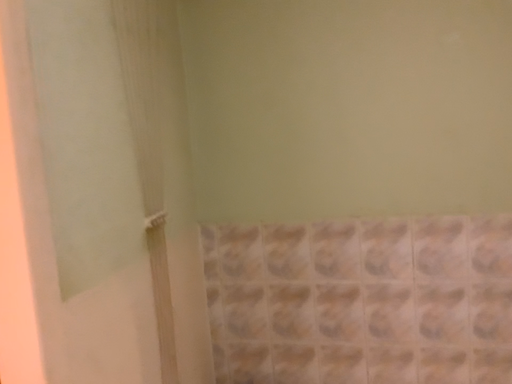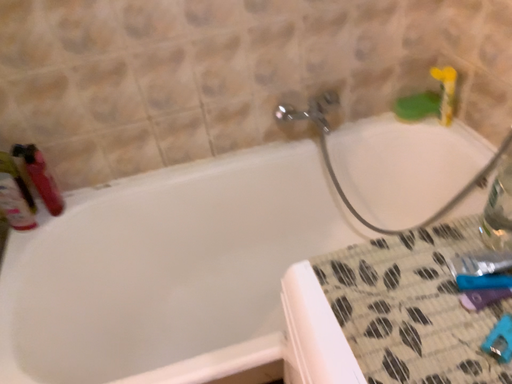
Question: How did the camera likely rotate when shooting the video?

Choices:
 (A) rotated upward
 (B) rotated downward

Answer: (B)